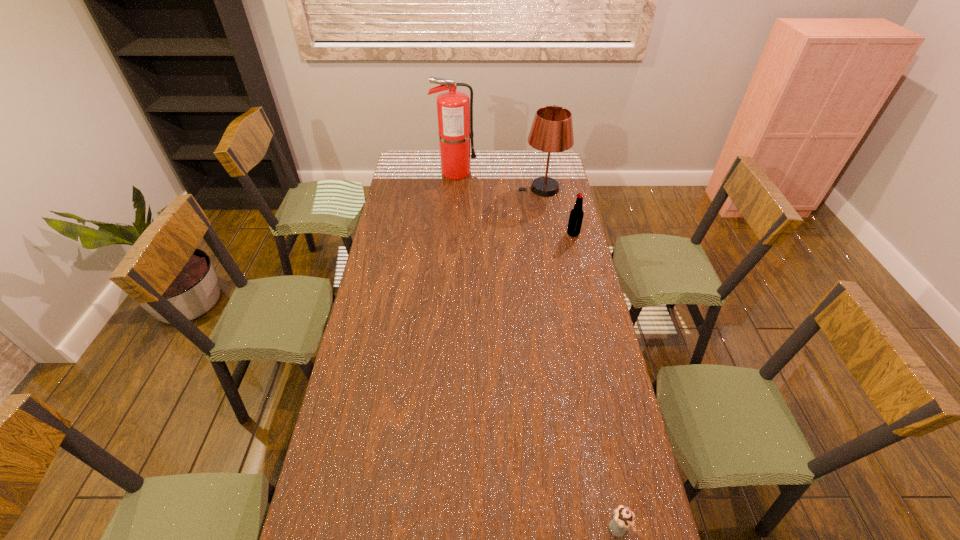
Where is `lampshade that is at the right edge`? lampshade that is at the right edge is located at coordinates (552, 130).

Identify the location of beer bottle that is at the right edge. The image size is (960, 540). (576, 215).

The image size is (960, 540). Identify the location of free region at the far edge. (496, 162).

Image resolution: width=960 pixels, height=540 pixels. In the image, there is a desktop. In order to click on vacant space at the left edge in this screenshot , I will do `click(347, 415)`.

In the image, there is a desktop. Where is `vacant region at the right edge`? The width and height of the screenshot is (960, 540). vacant region at the right edge is located at coordinates (567, 185).

At what (x,y) coordinates should I click in order to perform the action: click on vacant area at the far left corner. Please return your answer as a coordinate pair (x, y). This screenshot has height=540, width=960. Looking at the image, I should click on (425, 158).

In the image, there is a desktop. Identify the location of vacant region at the far right corner. (558, 158).

Identify the location of vacant space that's between the leftmost object and the lampshade. (499, 180).

The image size is (960, 540). What are the coordinates of `vacant area that lies between the third tallest object and the leftmost object` in the screenshot? It's located at point(515,203).

The width and height of the screenshot is (960, 540). In order to click on free spot between the leftmost object and the beer bottle in this screenshot , I will do `click(515, 203)`.